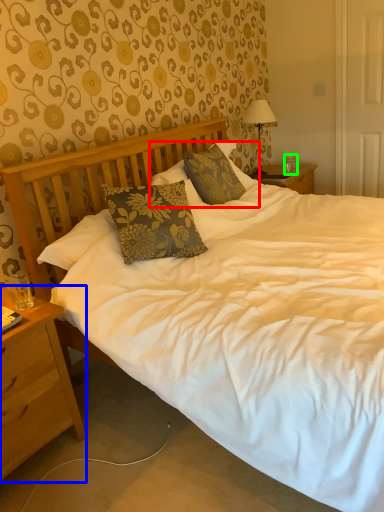
Question: Which object is positioned closest to pillow (highlighted by a red box)? Select from nightstand (highlighted by a blue box) and coffee cup (highlighted by a green box).

Choices:
 (A) nightstand
 (B) coffee cup

Answer: (A)